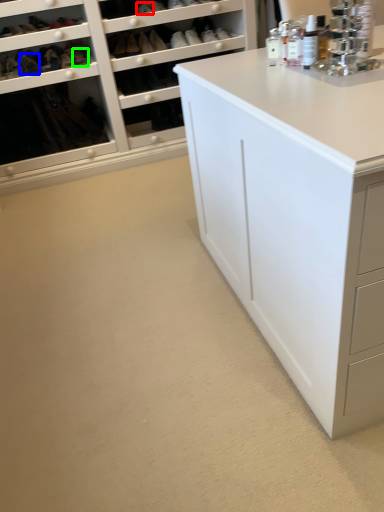
Question: Estimate the real-world distances between objects in this image. Which object is closer to shoe (highlighted by a red box), shoe (highlighted by a blue box) or shoe (highlighted by a green box)?

Choices:
 (A) shoe
 (B) shoe

Answer: (B)